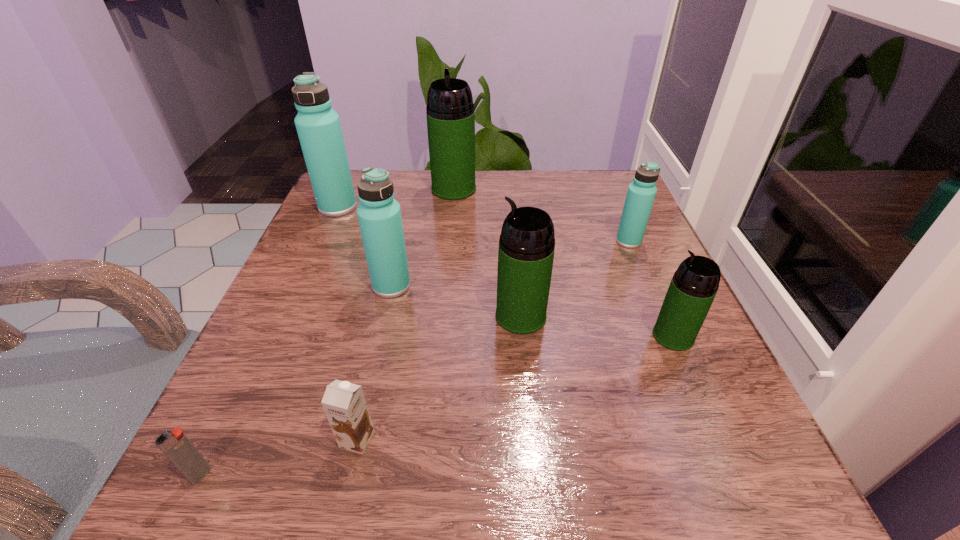
In order to click on the rightmost green thermos bottle in this screenshot , I will do `click(694, 285)`.

Locate an element on the screen. This screenshot has width=960, height=540. the second nearest object is located at coordinates (344, 403).

At what (x,y) coordinates should I click in order to perform the action: click on the seventh tallest object. Please return your answer as a coordinate pair (x, y). Image resolution: width=960 pixels, height=540 pixels. Looking at the image, I should click on click(344, 403).

Identify the location of the shortest object. The width and height of the screenshot is (960, 540). (177, 447).

Identify the location of igniter. The height and width of the screenshot is (540, 960). (177, 447).

Where is `free location located 0.290m from the spout of the farthest green thermos bottle`? Image resolution: width=960 pixels, height=540 pixels. free location located 0.290m from the spout of the farthest green thermos bottle is located at coordinates (445, 280).

The image size is (960, 540). What are the coordinates of `vacant space located 0.090m on the back of the biggest aqua thermos bottle` in the screenshot? It's located at (350, 179).

Find the location of a particular element. This screenshot has height=540, width=960. free location located 0.320m on the front of the nearest aqua thermos bottle is located at coordinates (350, 470).

Where is `vacant space located from the spout of the fourth thermos bottle from left to right`? vacant space located from the spout of the fourth thermos bottle from left to right is located at coordinates (336, 316).

Locate an element on the screen. The width and height of the screenshot is (960, 540). vacant area situated from the spout of the fourth thermos bottle from left to right is located at coordinates (416, 316).